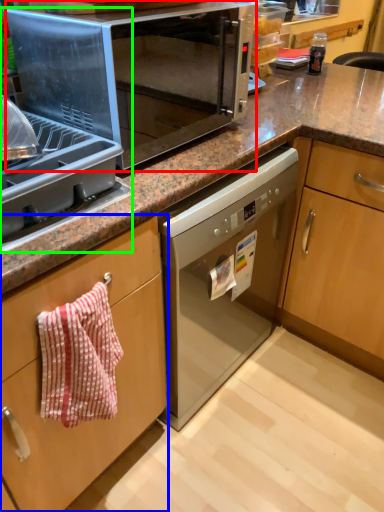
Question: Which object is the farthest from microwave oven (highlighted by a red box)? Choose among these: cabinetry (highlighted by a blue box) or appliance (highlighted by a green box).

Choices:
 (A) cabinetry
 (B) appliance

Answer: (A)